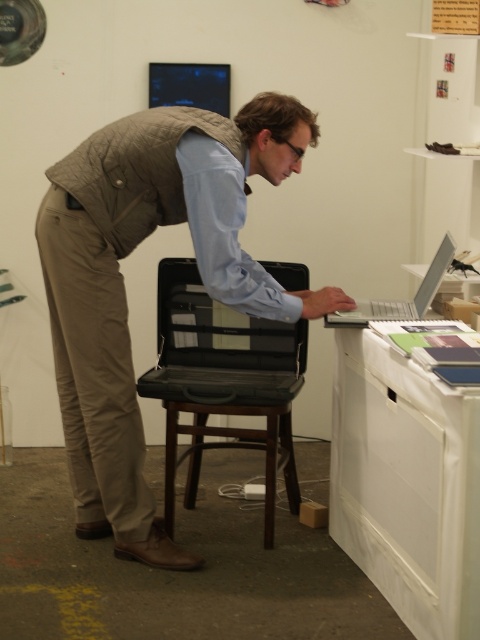
Question: In this image, where is light blue cotton dress shirt at center located relative to wooden stool at center?

Choices:
 (A) above
 (B) below

Answer: (A)

Question: Can you confirm if white glossy table at lower right is positioned below light blue cotton dress shirt at center?

Choices:
 (A) yes
 (B) no

Answer: (A)

Question: Which of the following is the farthest from the observer?

Choices:
 (A) light brown quilted vest at center
 (B) white glossy table at lower right
 (C) wooden stool at center
 (D) silver metallic laptop at upper right

Answer: (C)

Question: Can you confirm if light brown quilted vest at center is smaller than wooden stool at center?

Choices:
 (A) yes
 (B) no

Answer: (B)

Question: Based on their relative distances, which object is farther from the light blue cotton dress shirt at center?

Choices:
 (A) black hard plastic chair at center
 (B) silver metallic laptop at upper right

Answer: (B)

Question: Which object is the closest to the light brown quilted vest at center?

Choices:
 (A) light blue cotton dress shirt at center
 (B) wooden stool at center

Answer: (A)